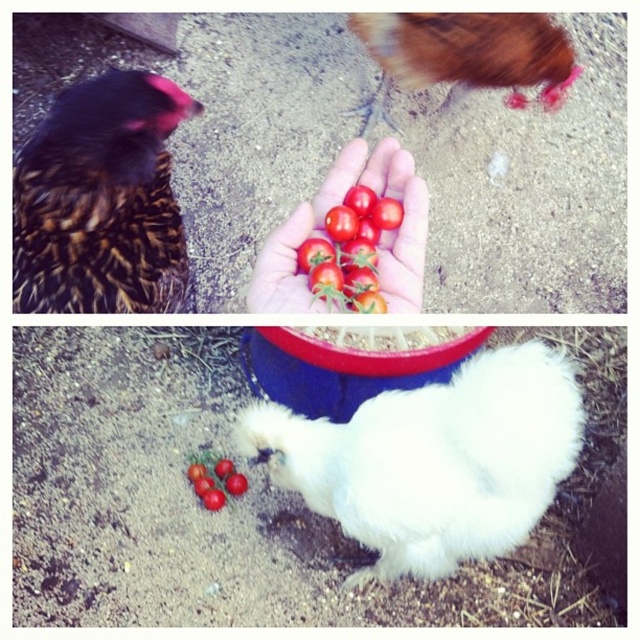
Between white fluffy chicken at lower center and red matte tomatoes at center, which one is positioned lower?

white fluffy chicken at lower center is lower down.

Who is more forward, (x=557, y=451) or (x=410, y=252)?

Positioned in front is point (x=410, y=252).

Locate an element on the screen. white fluffy chicken at lower center is located at coordinates (433, 460).

Is white fluffy chicken at lower center positioned in front of glossy cherry tomatoes at center?

No, it is not.

Between point (326, 497) and point (368, 252), which one is positioned behind?

The point (326, 497) is behind.

At what (x,y) coordinates should I click in order to perform the action: click on white fluffy chicken at lower center. Please return your answer as a coordinate pair (x, y). This screenshot has height=640, width=640. Looking at the image, I should click on (433, 460).

Does red matte tomatoes at center have a larger size compared to glossy cherry tomato at lower center?

Indeed, red matte tomatoes at center has a larger size compared to glossy cherry tomato at lower center.

Can you confirm if red matte tomatoes at center is taller than glossy cherry tomato at lower center?

Yes, red matte tomatoes at center is taller than glossy cherry tomato at lower center.

This screenshot has width=640, height=640. Describe the element at coordinates (324, 232) in the screenshot. I see `red matte tomatoes at center` at that location.

Where is `red matte tomatoes at center`? This screenshot has width=640, height=640. red matte tomatoes at center is located at coordinates (324, 232).